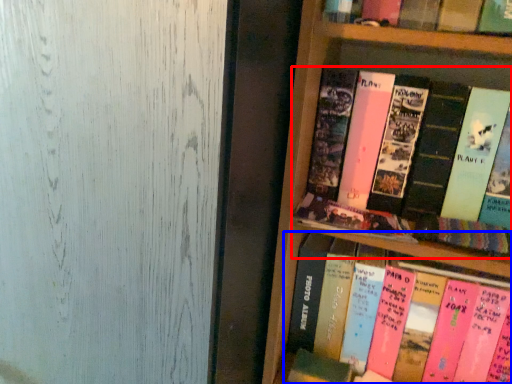
Question: Among these objects, which one is nearest to the camera, book (highlighted by a red box) or book (highlighted by a blue box)?

Choices:
 (A) book
 (B) book

Answer: (A)